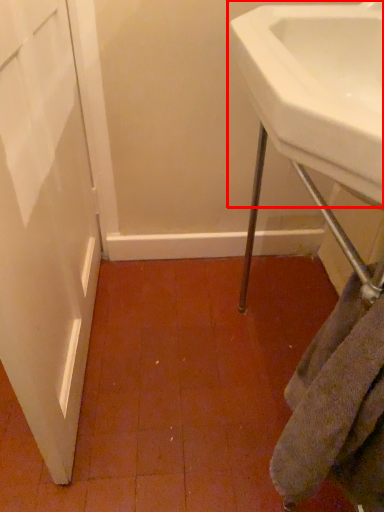
Question: Observing the image, what is the correct spatial positioning of sink (annotated by the red box) in reference to towel/napkin?

Choices:
 (A) right
 (B) left

Answer: (A)